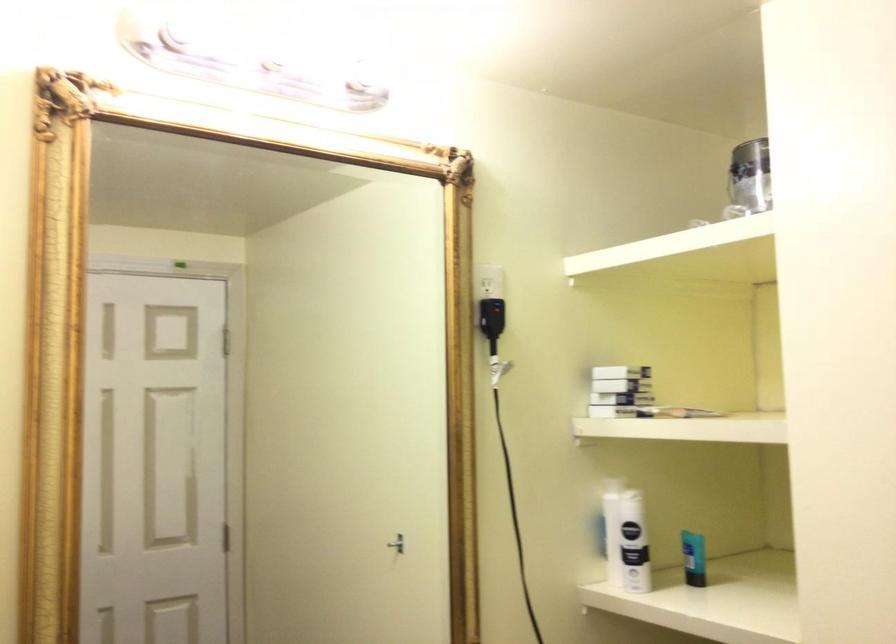
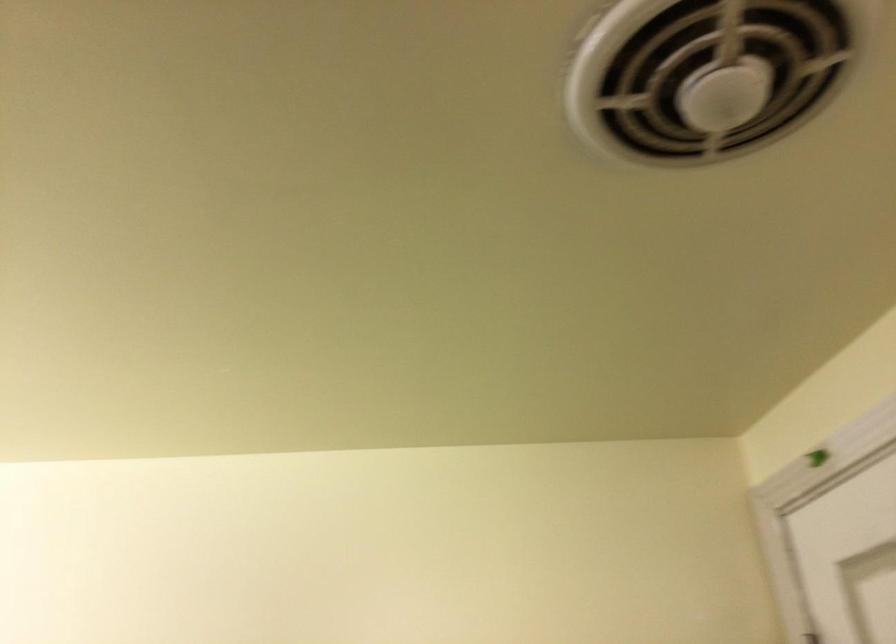
From the picture: First-person continuous shooting, in which direction is the camera rotating?

The rotation direction of the camera is right-up.